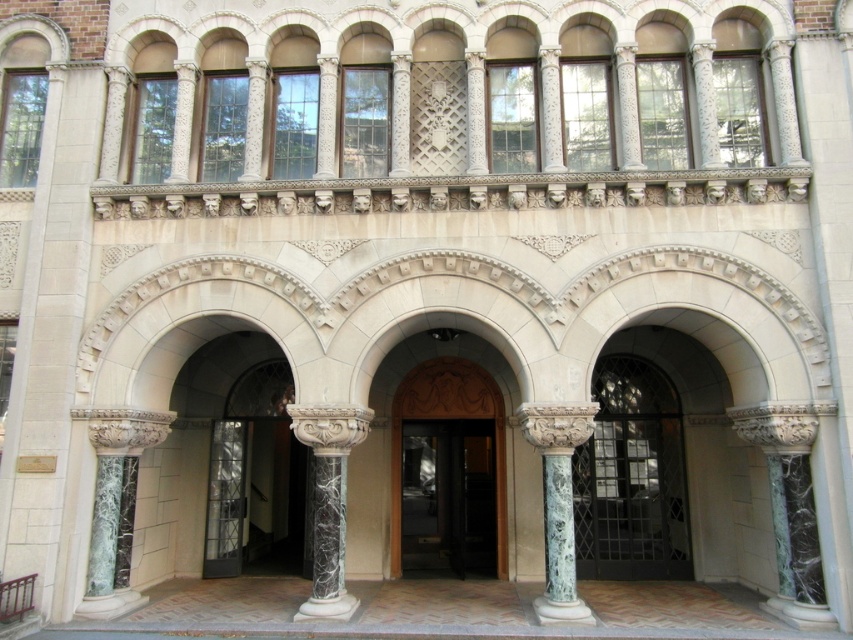
You are an architect inspecting the building facade. You need to determine which object, the dark green marble door at center or the marble column at center, is bigger in size. Based on the architectural details provided, which one is larger?

The dark green marble door at center has a larger size compared to the marble column at center, so the dark green marble door at center is bigger.